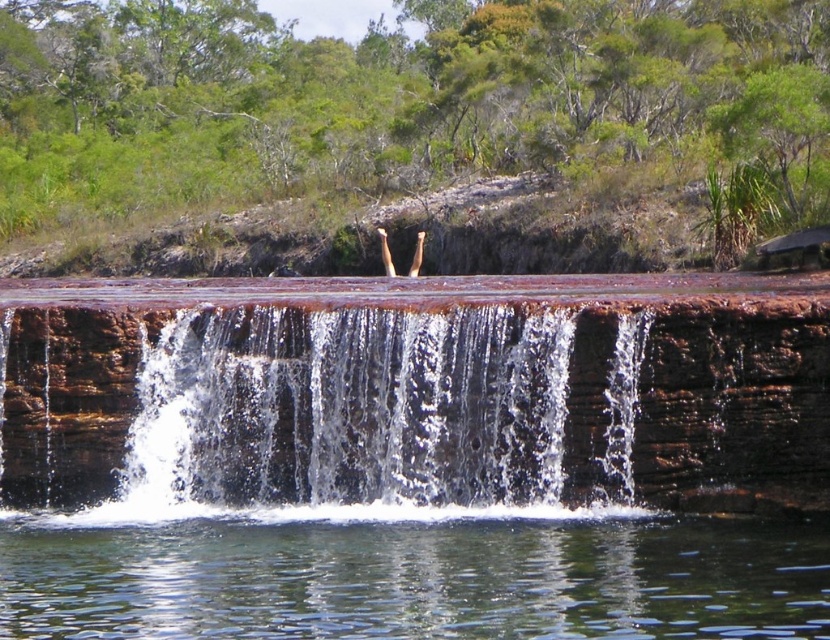
Which is in front, point (491, 500) or point (731, 580)?

Point (731, 580) is more forward.

Does point (311, 452) lie behind point (384, 520)?

Yes, it is.

The image size is (830, 640). Describe the element at coordinates (326, 410) in the screenshot. I see `brown rock waterfall at center` at that location.

Find the location of a particular element. This screenshot has height=640, width=830. brown rock waterfall at center is located at coordinates (326, 410).